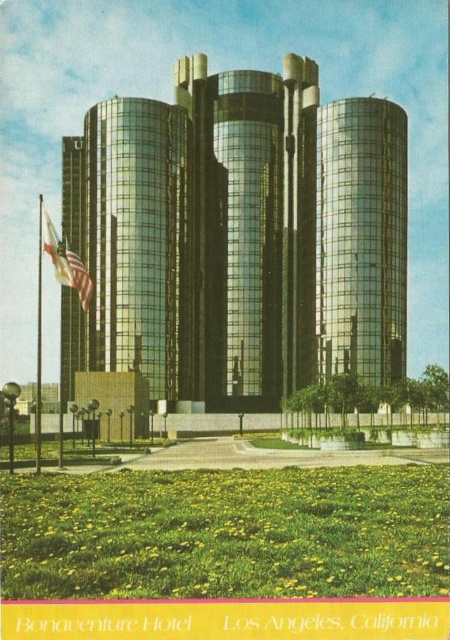
You are standing in front of the Bonaventure Hotel. You see the shiny glass building at center and the american flag at left. Which object is more to the left?

The american flag at left is more to the left than the shiny glass building at center.

You are standing in front of the Bonaventure Hotel and notice the american flag at left and the metallic flag pole at left. Which object is shorter?

The american flag at left is shorter than the metallic flag pole at left.

Based on the photo, you are standing at the entrance of the Bonaventure Hotel and see the point marked at coordinates (x=238, y=240). Based on the description, where is this point located?

The point marked at coordinates (x=238, y=240) is on the shiny glass building at center.